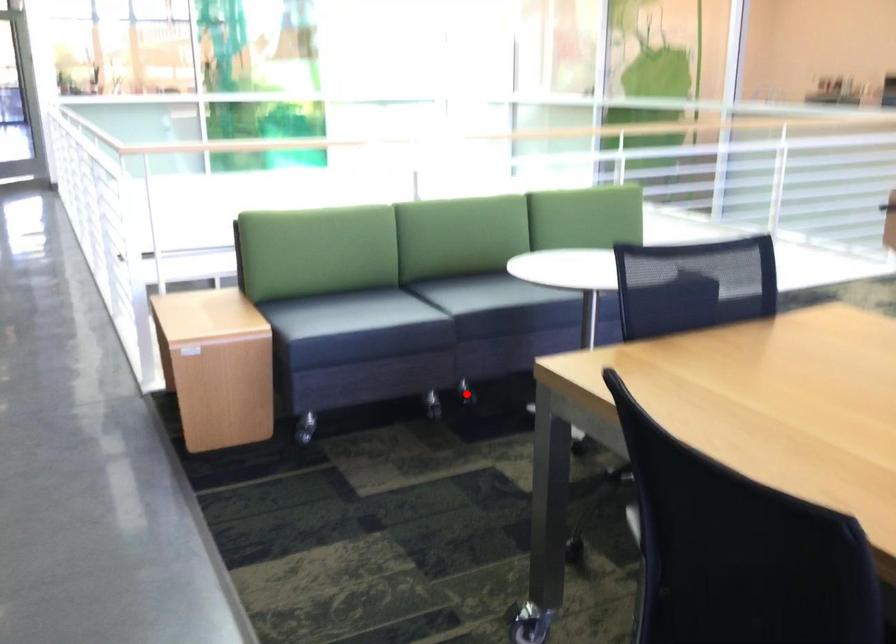
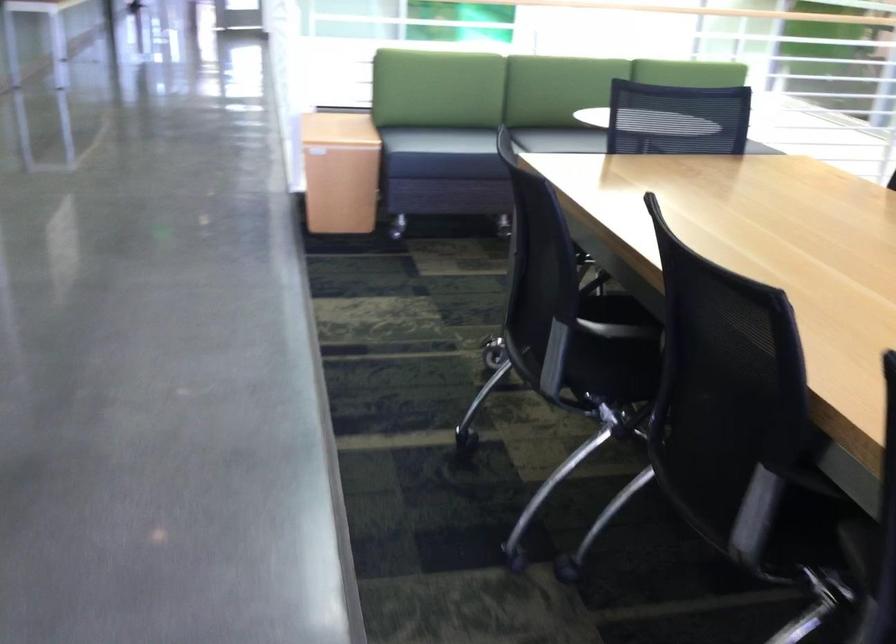
Question: I am providing you with two images of the same scene from different viewpoints. A red point is marked on the first image. At the location where the point appears in image 1, is it still visible in image 2?

Choices:
 (A) Yes
 (B) No

Answer: (B)